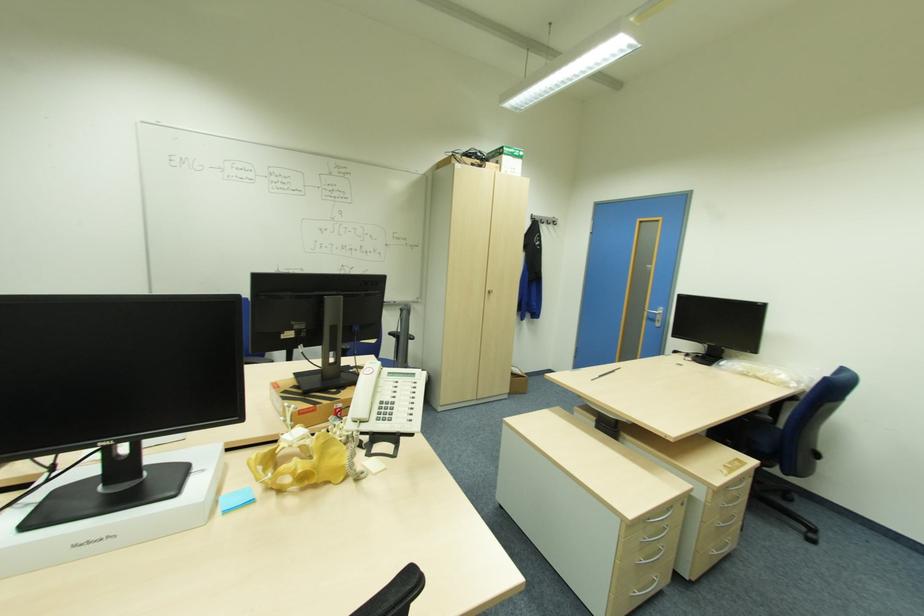
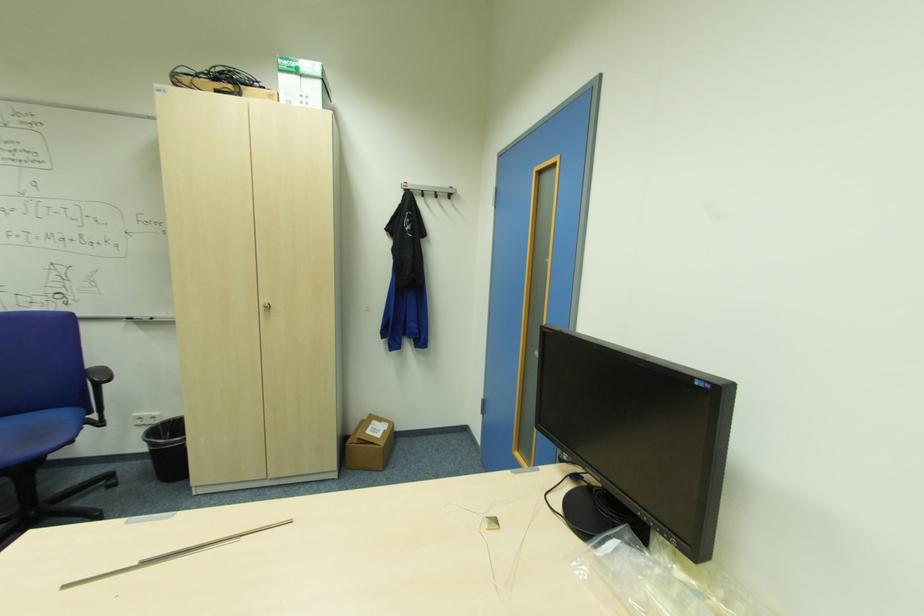
The point at (550,220) is marked in the first image. Where is the corresponding point in the second image?

(439, 192)